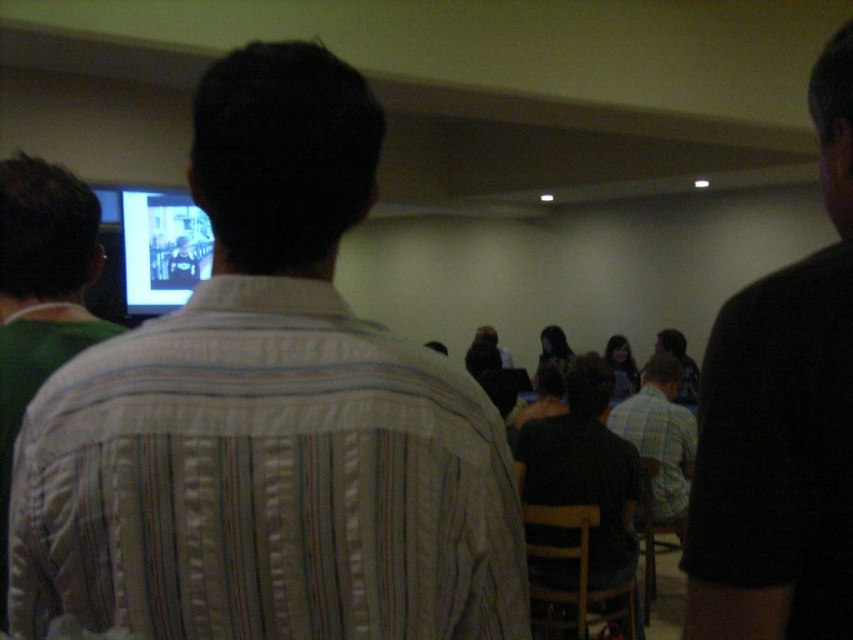
Question: Is white striped shirt at center bigger than black glossy screen at upper left?

Choices:
 (A) no
 (B) yes

Answer: (A)

Question: Which of the following is the closest to the observer?

Choices:
 (A) (210, 259)
 (B) (757, 362)
 (C) (688, 420)
 (D) (614, 554)

Answer: (B)

Question: Which of the following is the farthest from the observer?

Choices:
 (A) black matte shirt at right
 (B) white striped shirt at center
 (C) plaid cotton shirt at center

Answer: (C)

Question: Is white striped shirt at center above dark gray shirt at center?

Choices:
 (A) yes
 (B) no

Answer: (A)

Question: Which point is closer to the camera?

Choices:
 (A) black glossy screen at upper left
 (B) white striped shirt at center
 (C) black matte shirt at right
 (D) dark gray shirt at center

Answer: (B)

Question: Is white striped shirt at center to the left of black matte shirt at right from the viewer's perspective?

Choices:
 (A) yes
 (B) no

Answer: (A)